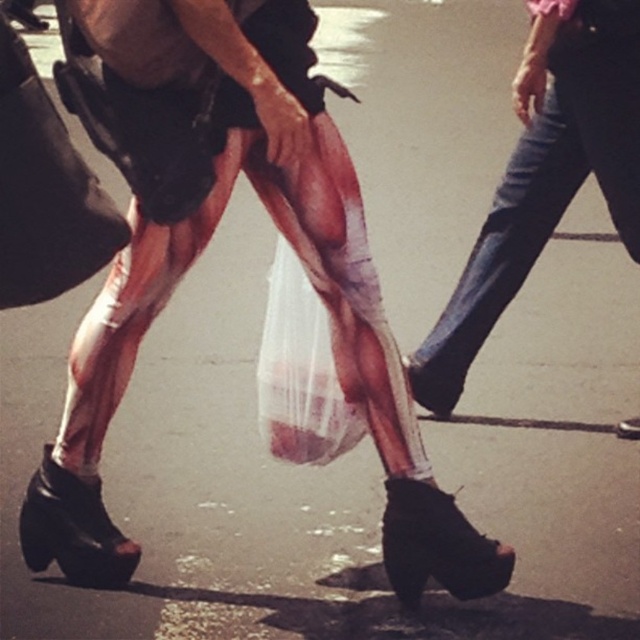
Question: Is metallic silver tights at center to the right of jeans at right from the viewer's perspective?

Choices:
 (A) yes
 (B) no

Answer: (B)

Question: Which point is closer to the camera taking this photo?

Choices:
 (A) (291, 205)
 (B) (531, 152)

Answer: (A)

Question: Which point appears closest to the camera in this image?

Choices:
 (A) (468, 256)
 (B) (396, 557)

Answer: (B)

Question: Is metallic silver tights at center further to the viewer compared to jeans at right?

Choices:
 (A) no
 (B) yes

Answer: (A)

Question: Which point is closer to the camera?

Choices:
 (A) metallic silver tights at center
 (B) jeans at right

Answer: (A)

Question: Is metallic silver tights at center above jeans at right?

Choices:
 (A) yes
 (B) no

Answer: (B)